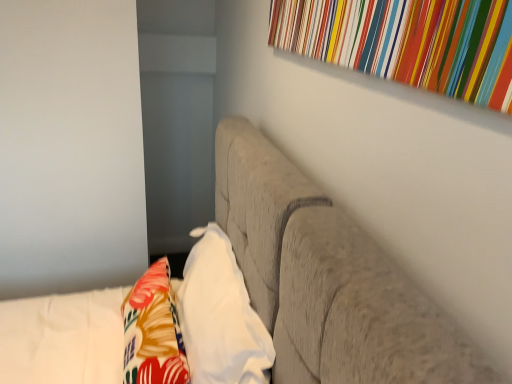
Question: Does white soft pillow at center have a greater width compared to floral fabric throw pillow at lower left?

Choices:
 (A) no
 (B) yes

Answer: (A)

Question: Is white soft pillow at center turned away from floral fabric throw pillow at lower left?

Choices:
 (A) no
 (B) yes

Answer: (B)

Question: Is white soft pillow at center at the left side of floral fabric throw pillow at lower left?

Choices:
 (A) no
 (B) yes

Answer: (A)

Question: From a real-world perspective, is white soft pillow at center on top of floral fabric throw pillow at lower left?

Choices:
 (A) no
 (B) yes

Answer: (B)

Question: Is white soft pillow at center next to floral fabric throw pillow at lower left?

Choices:
 (A) yes
 (B) no

Answer: (B)

Question: Considering the positions of textured gray sofa at center and multicolored striped fabric at upper right in the image, is textured gray sofa at center taller or shorter than multicolored striped fabric at upper right?

Choices:
 (A) tall
 (B) short

Answer: (A)

Question: From the image's perspective, is textured gray sofa at center located above or below multicolored striped fabric at upper right?

Choices:
 (A) above
 (B) below

Answer: (B)

Question: Does point (368, 362) appear closer or farther from the camera than point (324, 29)?

Choices:
 (A) farther
 (B) closer

Answer: (B)

Question: In terms of size, does textured gray sofa at center appear bigger or smaller than multicolored striped fabric at upper right?

Choices:
 (A) big
 (B) small

Answer: (A)

Question: Is white soft pillow at center in front of or behind floral fabric throw pillow at lower left in the image?

Choices:
 (A) front
 (B) behind

Answer: (A)

Question: From a real-world perspective, is white soft pillow at center above or below floral fabric throw pillow at lower left?

Choices:
 (A) above
 (B) below

Answer: (A)

Question: From the image's perspective, is white soft pillow at center located above or below floral fabric throw pillow at lower left?

Choices:
 (A) above
 (B) below

Answer: (A)

Question: Is white soft pillow at center inside the boundaries of floral fabric throw pillow at lower left, or outside?

Choices:
 (A) inside
 (B) outside

Answer: (B)

Question: Is textured gray sofa at center bigger or smaller than floral fabric throw pillow at lower left?

Choices:
 (A) small
 (B) big

Answer: (B)

Question: Is textured gray sofa at center inside the boundaries of floral fabric throw pillow at lower left, or outside?

Choices:
 (A) inside
 (B) outside

Answer: (B)